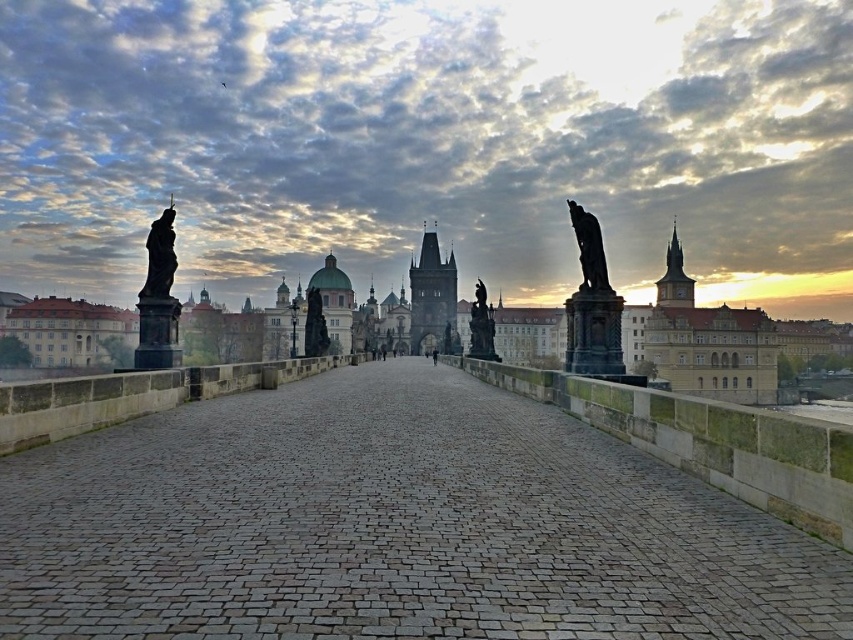
Question: Does polished bronze statue at right have a larger size compared to black stone statue at right?

Choices:
 (A) no
 (B) yes

Answer: (B)

Question: Which of the following is the closest to the observer?

Choices:
 (A) (471, 349)
 (B) (154, 337)

Answer: (B)

Question: Which of the following is the closest to the observer?

Choices:
 (A) polished bronze statue at center
 (B) black stone statue at center

Answer: (B)

Question: Which of the following is the farthest from the observer?

Choices:
 (A) polished bronze statue at right
 (B) black stone statue at right
 (C) gray cobblestone path at center
 (D) polished bronze statue at center

Answer: (D)

Question: Is gray cobblestone path at center bigger than black stone statue at right?

Choices:
 (A) no
 (B) yes

Answer: (B)

Question: Does polished bronze statue at right have a smaller size compared to bronze statue at left?

Choices:
 (A) yes
 (B) no

Answer: (A)